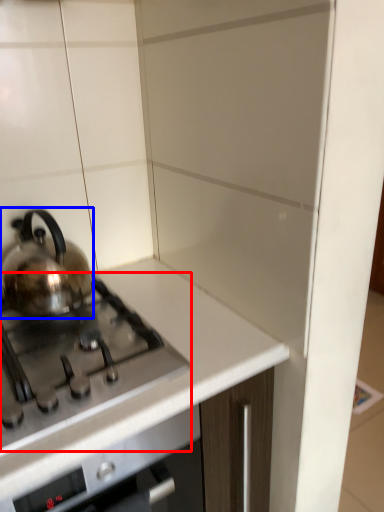
Question: Which object is further to the camera taking this photo, gas stove (highlighted by a red box) or kettle (highlighted by a blue box)?

Choices:
 (A) gas stove
 (B) kettle

Answer: (B)